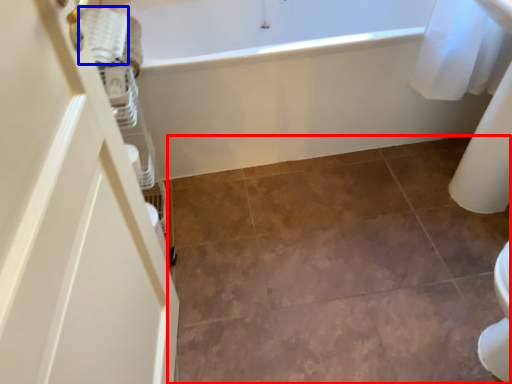
Question: Which object is closer to the camera taking this photo, ceramic tile (highlighted by a red box) or material (highlighted by a blue box)?

Choices:
 (A) ceramic tile
 (B) material

Answer: (A)